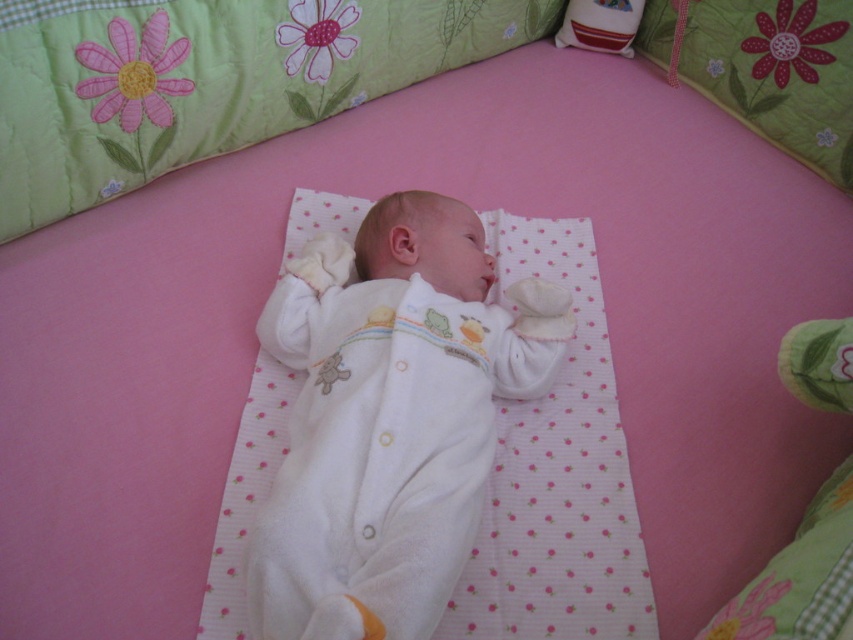
Question: Which of the following is the closest to the observer?

Choices:
 (A) velvety white pillow at upper right
 (B) white soft fabric newborn at center
 (C) green quilted pillow at upper center

Answer: (B)

Question: Does white soft fabric newborn at center appear on the right side of velvety white pillow at upper right?

Choices:
 (A) yes
 (B) no

Answer: (B)

Question: Which point is closer to the camera taking this photo?

Choices:
 (A) (633, 29)
 (B) (524, 310)

Answer: (B)

Question: Is green quilted pillow at upper center wider than velvety white pillow at upper right?

Choices:
 (A) yes
 (B) no

Answer: (A)

Question: Can you confirm if green quilted pillow at upper center is smaller than velvety white pillow at upper right?

Choices:
 (A) no
 (B) yes

Answer: (A)

Question: Based on their relative distances, which object is nearer to the white soft fabric newborn at center?

Choices:
 (A) green quilted pillow at upper center
 (B) velvety white pillow at upper right

Answer: (A)